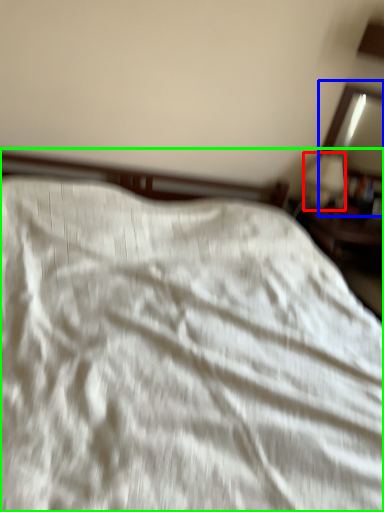
Question: Estimate the real-world distances between objects in this image. Which object is closer to table lamp (highlighted by a red box), mirror (highlighted by a blue box) or bed (highlighted by a green box)?

Choices:
 (A) mirror
 (B) bed

Answer: (A)